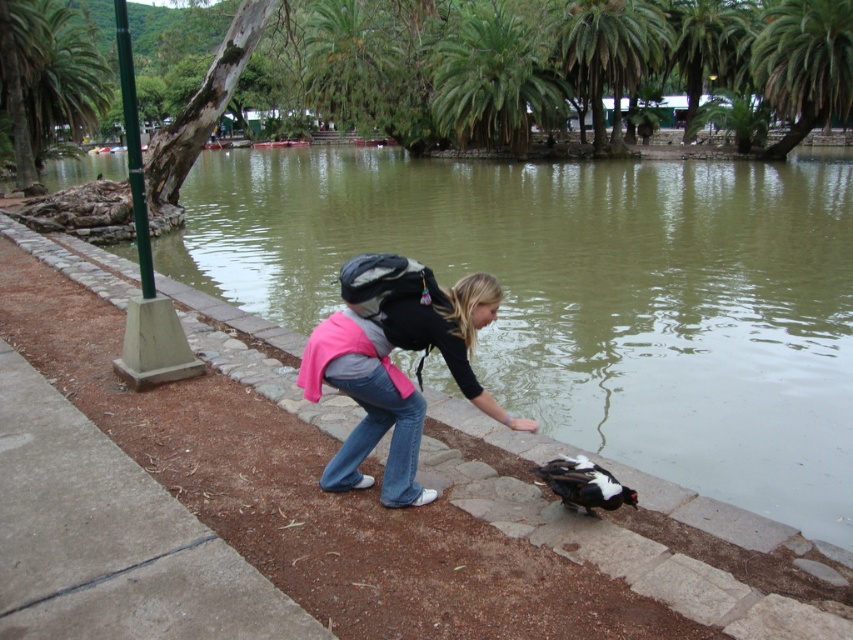
Question: Which point is farther to the camera?

Choices:
 (A) pink fabric backpack at center
 (B) greenish water at center

Answer: (B)

Question: Is greenish water at center to the right of pink fabric backpack at center from the viewer's perspective?

Choices:
 (A) yes
 (B) no

Answer: (A)

Question: Is greenish water at center further to the viewer compared to pink fabric backpack at center?

Choices:
 (A) yes
 (B) no

Answer: (A)

Question: Does greenish water at center have a greater width compared to pink fabric backpack at center?

Choices:
 (A) no
 (B) yes

Answer: (B)

Question: Which point is closer to the camera?

Choices:
 (A) (398, 412)
 (B) (222, 150)

Answer: (A)